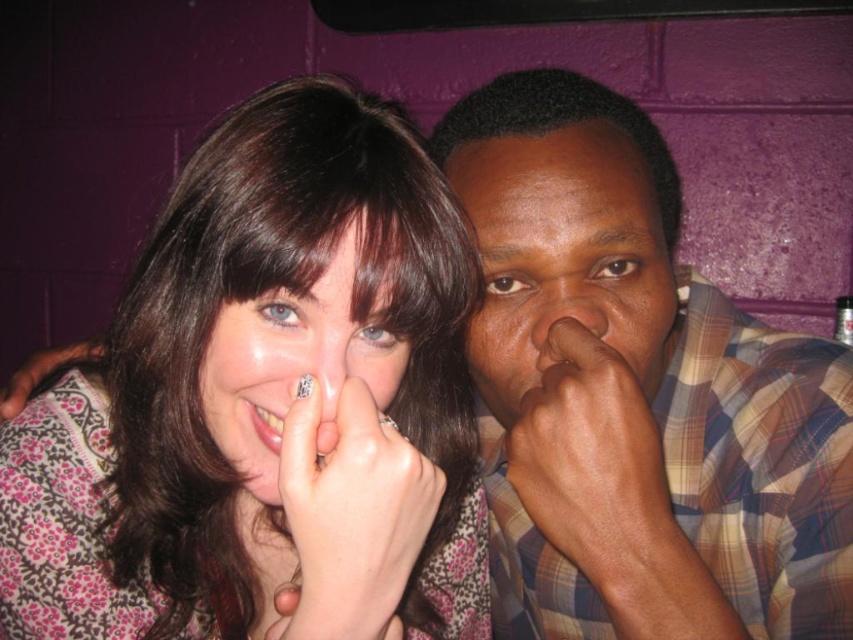
Does matte plaid shirt at right appear under matte skin nose at center?

Correct, matte plaid shirt at right is located below matte skin nose at center.

Consider the image. Between matte plaid shirt at right and matte skin nose at center, which one is positioned higher?

matte skin nose at center is above.

Who is more distant from viewer, (477,241) or (351,330)?

The point (477,241) is behind.

Locate an element on the screen. The width and height of the screenshot is (853, 640). matte plaid shirt at right is located at coordinates tap(639, 396).

Between point (610, 385) and point (604, 275), which one is positioned in front?

Point (610, 385)

Describe the element at coordinates (595, 467) in the screenshot. This screenshot has height=640, width=853. I see `dark brown skin/hair at nose` at that location.

I want to click on dark brown skin/hair at nose, so click(x=595, y=467).

Does matte plaid shirt at center appear on the left side of matte floral shirt at center?

In fact, matte plaid shirt at center is to the right of matte floral shirt at center.

This screenshot has height=640, width=853. What do you see at coordinates (564, 257) in the screenshot?
I see `matte plaid shirt at center` at bounding box center [564, 257].

Is point (514, 252) closer to viewer compared to point (309, 372)?

No, it is not.

At what (x,y) coordinates should I click in order to perform the action: click on matte plaid shirt at center. Please return your answer as a coordinate pair (x, y). Looking at the image, I should click on (564, 257).